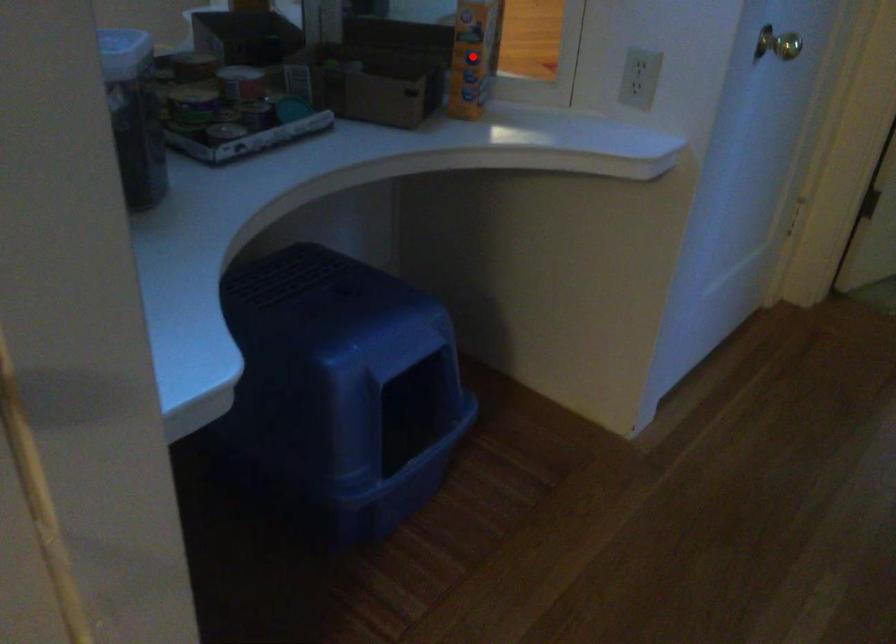
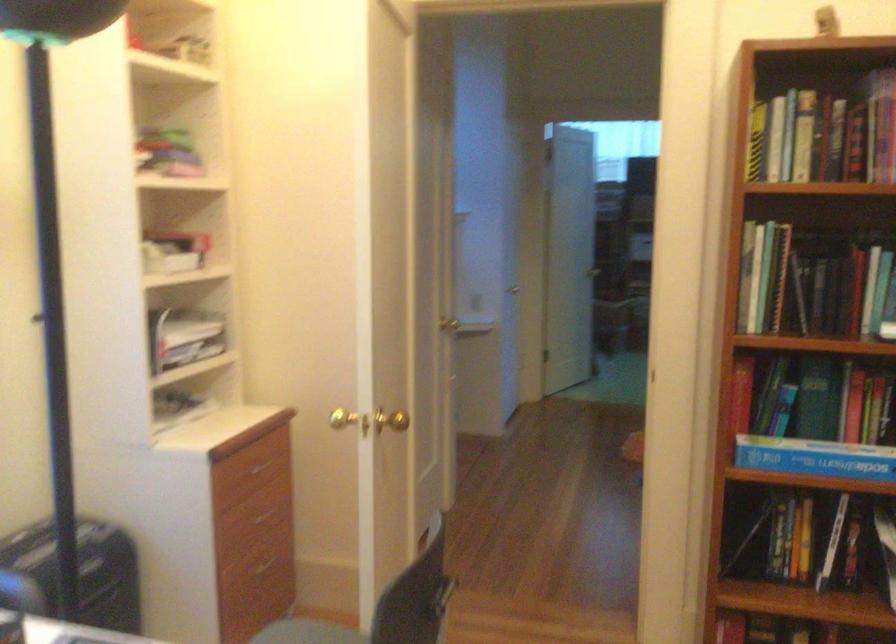
Question: I am providing you with two images of the same scene from different viewpoints. A red point is marked on the first image. Is the red point's position out of view in image 2?

Choices:
 (A) Yes
 (B) No

Answer: (A)